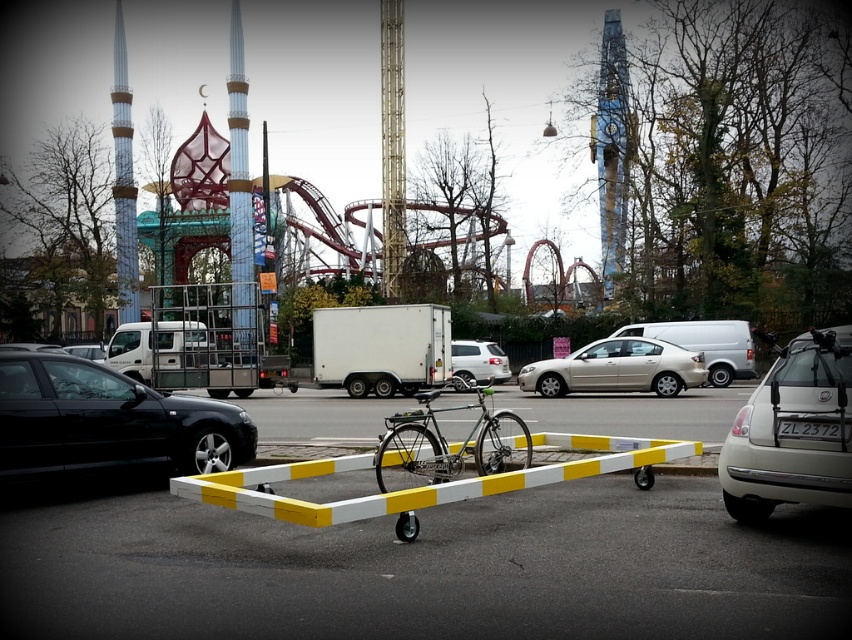
Does white matte car at right have a smaller size compared to yellow/white striped barricade at center?

Yes.

Measure the distance between point (815,417) and camera.

Point (815,417) and camera are 22.51 feet apart.

Where is `white matte car at right`? This screenshot has height=640, width=852. white matte car at right is located at coordinates (793, 432).

Does yellow/white plastic frame at center have a greater height compared to white matte car at center?

No.

Consider the image. Is yellow/white plastic frame at center thinner than white matte car at center?

No, yellow/white plastic frame at center is not thinner than white matte car at center.

Find the location of a particular element. yellow/white plastic frame at center is located at coordinates (426, 568).

From the picture: Is yellow/white striped barricade at center above gold metallic sedan at center?

No.

Does yellow/white striped barricade at center have a larger size compared to gold metallic sedan at center?

Indeed, yellow/white striped barricade at center has a larger size compared to gold metallic sedan at center.

In order to click on yellow/white striped barricade at center in this screenshot , I will do `click(419, 486)`.

Locate an element on the screen. yellow/white striped barricade at center is located at coordinates (419, 486).